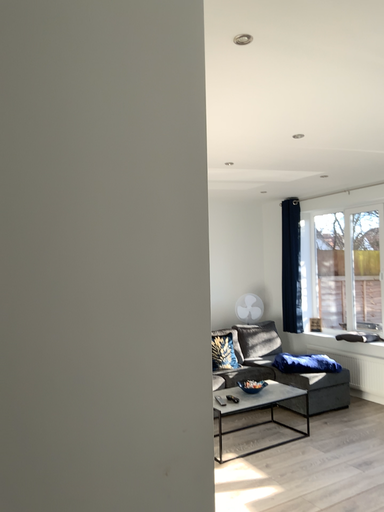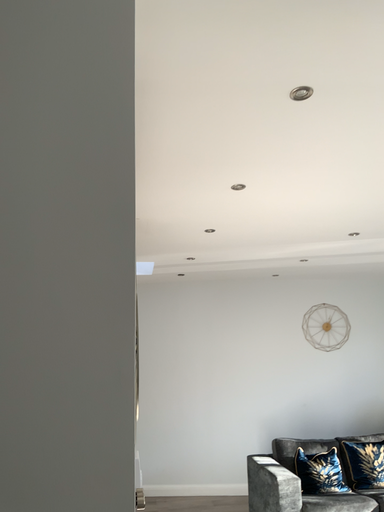
Question: How did the camera likely rotate when shooting the video?

Choices:
 (A) rotated upward
 (B) rotated downward

Answer: (A)